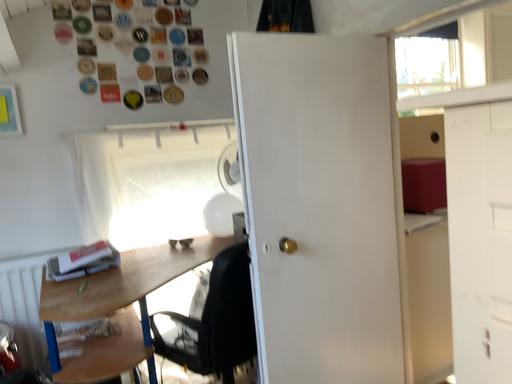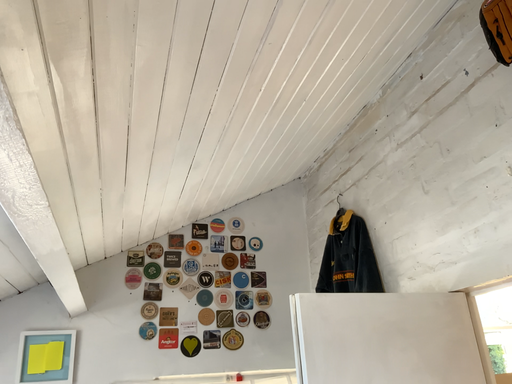
Question: How did the camera likely rotate when shooting the video?

Choices:
 (A) rotated downward
 (B) rotated upward

Answer: (B)